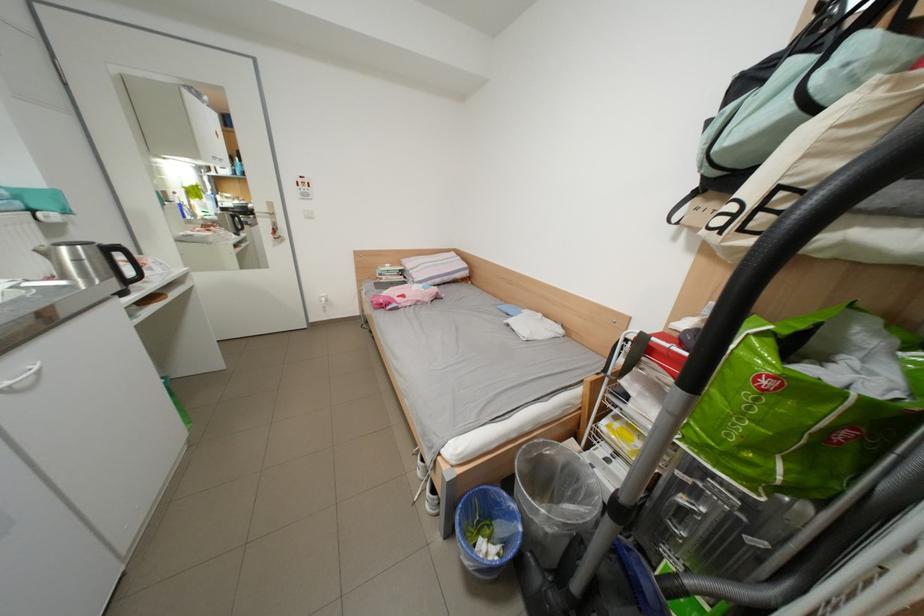
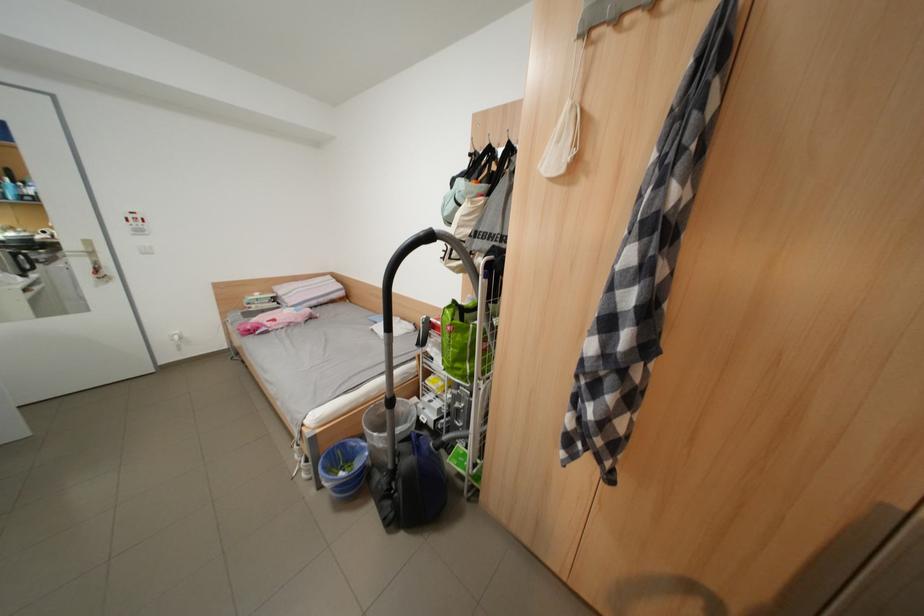
Where in the second image is the point corresponding to the point at 424,276 from the first image?

(298, 302)